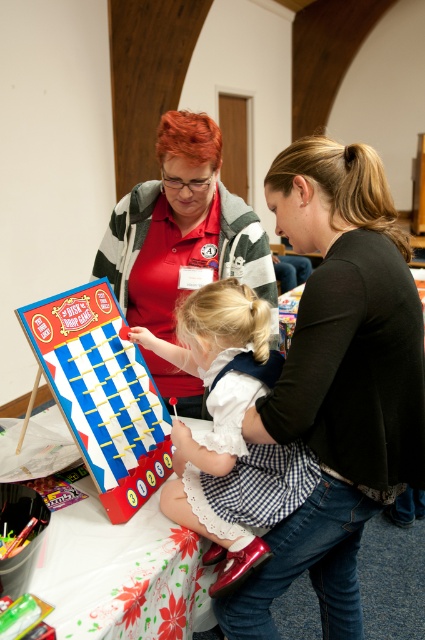
Question: Which of the following is the closest to the observer?

Choices:
 (A) white checkered skirt at center
 (B) matte red shirt at center
 (C) black matte shirt at center
 (D) wooden table at center

Answer: (D)

Question: Observing the image, what is the correct spatial positioning of black matte shirt at center in reference to wooden table at center?

Choices:
 (A) below
 (B) above

Answer: (B)

Question: Where is black matte shirt at center located in relation to white checkered skirt at center in the image?

Choices:
 (A) below
 (B) above

Answer: (B)

Question: Does matte red shirt at center appear over wooden table at center?

Choices:
 (A) no
 (B) yes

Answer: (B)

Question: Which object is the closest to the white checkered skirt at center?

Choices:
 (A) matte plastic game board at lower left
 (B) black matte shirt at center

Answer: (B)

Question: Which point is closer to the camera?

Choices:
 (A) (212, 148)
 (B) (93, 289)
 (C) (370, 189)

Answer: (C)